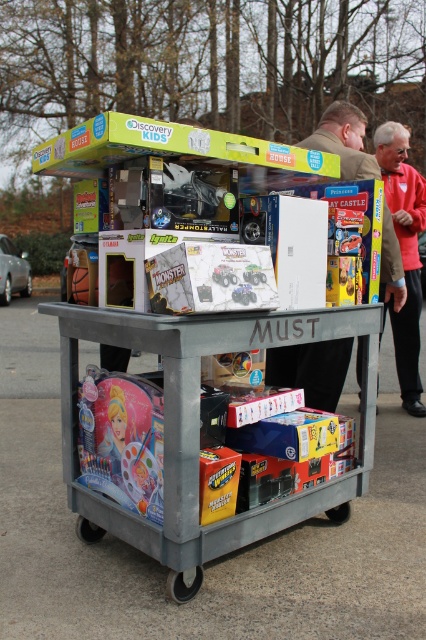
From the picture: You are a delivery person who needs to place a 2.5 meter long item between the brown leather jacket at upper right and the gray utility cart labeled

The distance between the brown leather jacket at upper right and the gray utility cart labeled

You are a child trying to reach both the matte pink princess doll at lower left and the matte white plastic toy car at center. Which toy is closer to you?

The matte pink princess doll at lower left is closer to you since the matte white plastic toy car at center is positioned behind it.